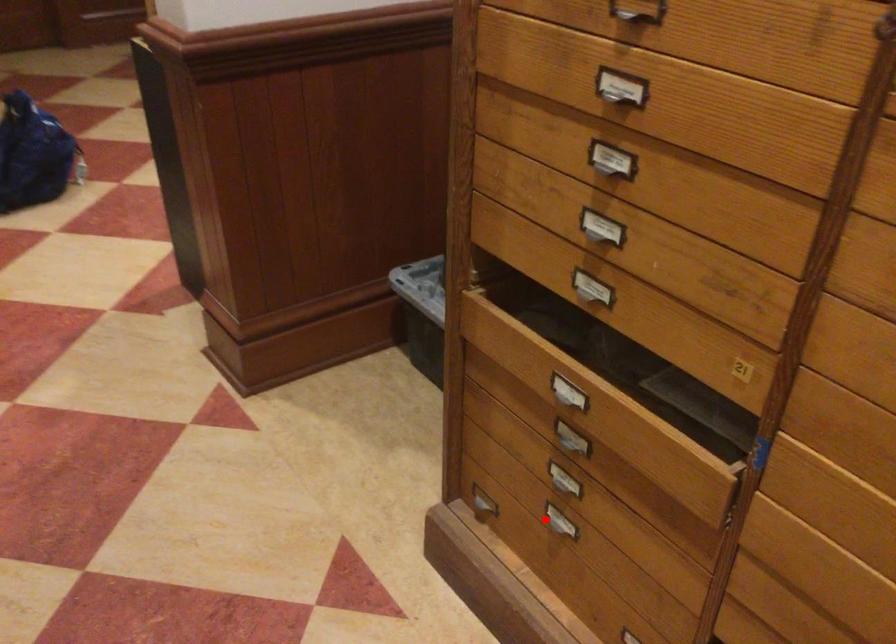
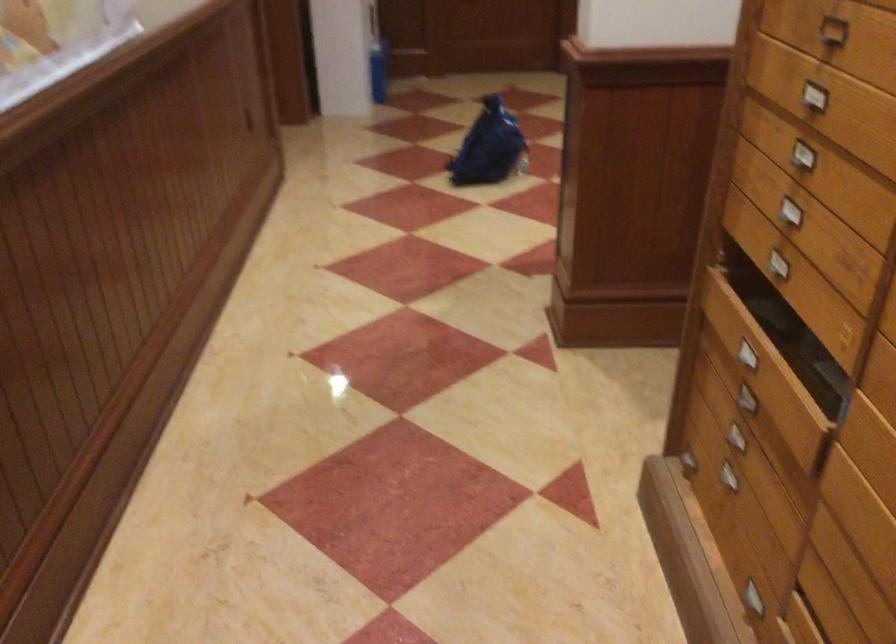
Question: I am providing you with two images of the same scene from different viewpoints. In image1, a red point is highlighted. Considering the same 3D point in image2, which of the following is correct?

Choices:
 (A) It is closer
 (B) It is farther

Answer: (B)